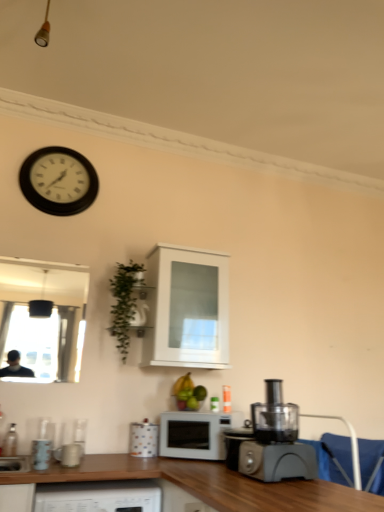
Locate an element on the screen. The height and width of the screenshot is (512, 384). blank space above black plastic clock at upper left (from a real-world perspective) is located at coordinates (66, 151).